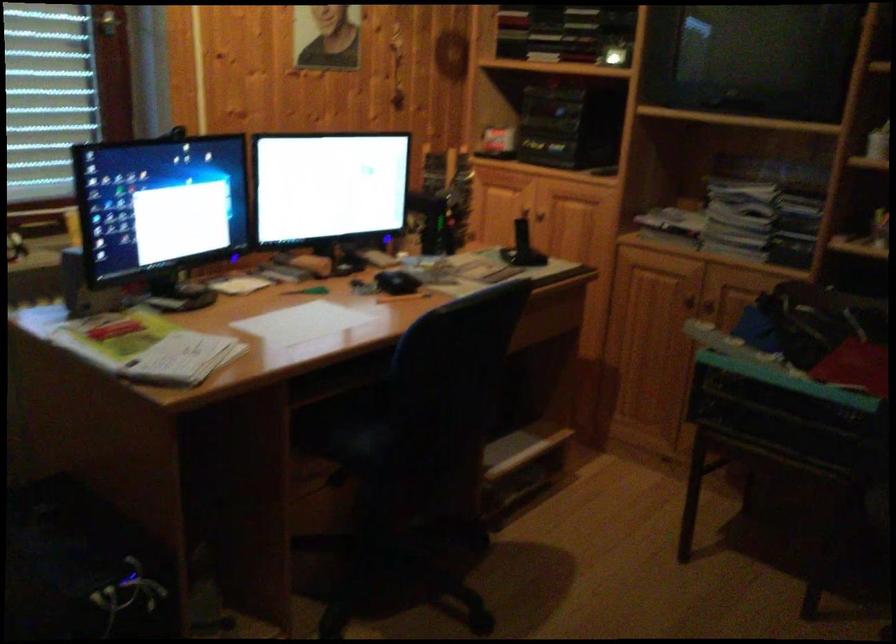
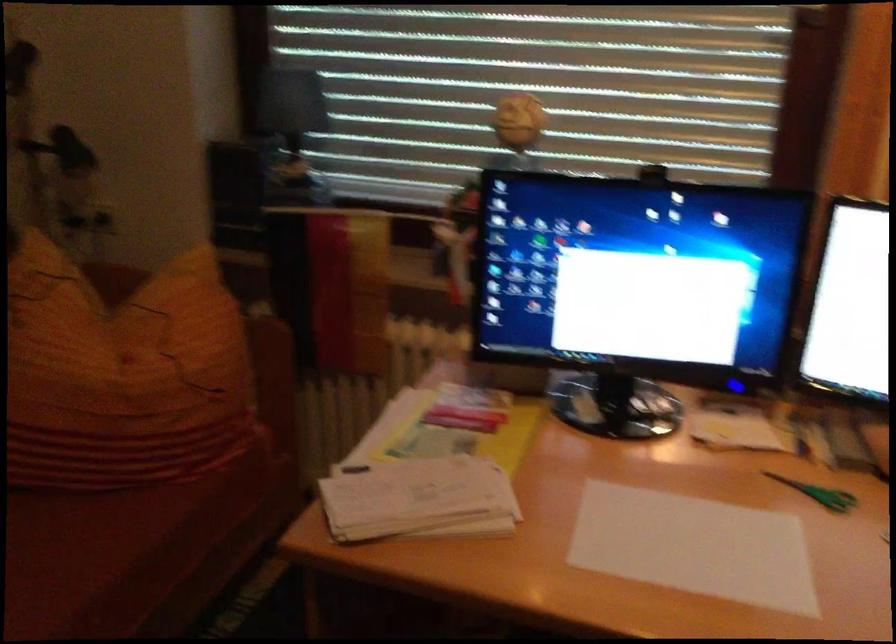
In the second image, find the point that corresponds to the point at 311,290 in the first image.

(819, 493)